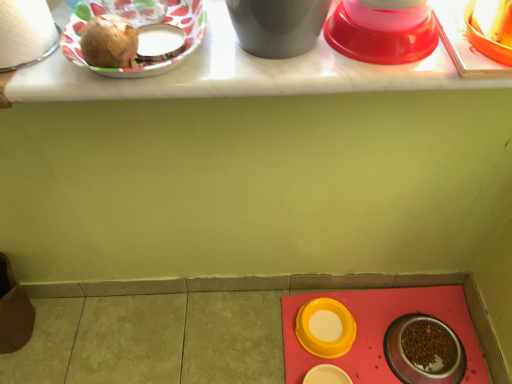
Identify the location of free space to the right of shiny brown onion at upper left. The image size is (512, 384). (227, 62).